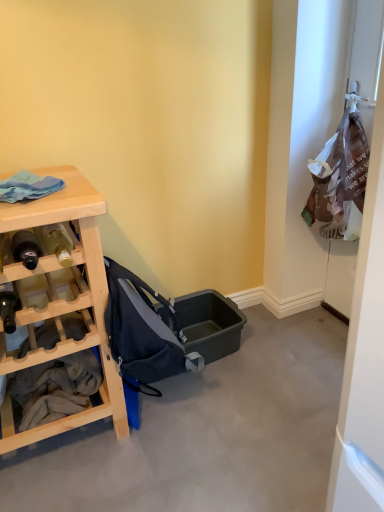
You are a GUI agent. You are given a task and a screenshot of the screen. Output one action in this format:
    pyautogui.click(x=<x>, y=<y>)
    Task: Click on the white cotton towels at left
    The image size is (384, 512).
    Given the screenshot: What is the action you would take?
    pyautogui.click(x=56, y=388)

What is the approximate width of matte black bottle at left, the third bottle in the top-to-bottom sequence?

matte black bottle at left, the third bottle in the top-to-bottom sequence, is 22.05 centimeters in width.

Looking at this image, measure the distance between point (79,220) and camera.

The distance of point (79,220) from camera is 1.14 meters.

Based on the photo, in order to face dark blue fabric baby carriage at center, should I rotate leftwards or rightwards?

Rotate left and turn 6.428 degrees.

Where is `white cotton towels at left`? white cotton towels at left is located at coordinates (56, 388).

Is natural wood desk at left aimed at matte black bottle at left, the third bottle in the top-to-bottom sequence?

Yes, natural wood desk at left is turned towards matte black bottle at left, the third bottle in the top-to-bottom sequence.

Can you confirm if natural wood desk at left is taller than matte black bottle at left, the 1th bottle ordered from the bottom?

Indeed, natural wood desk at left has a greater height compared to matte black bottle at left, the 1th bottle ordered from the bottom.

Considering the relative positions of natural wood desk at left and matte black bottle at left, the third bottle in the top-to-bottom sequence, in the image provided, is natural wood desk at left to the right of matte black bottle at left, the third bottle in the top-to-bottom sequence, from the viewer's perspective?

Yes, natural wood desk at left is to the right of matte black bottle at left, the third bottle in the top-to-bottom sequence.

From a real-world perspective, relative to matte black bottle at left, the 1th bottle ordered from the bottom, is natural wood desk at left vertically above or below?

In terms of real-world spatial position, natural wood desk at left is below matte black bottle at left, the 1th bottle ordered from the bottom.

Considering the relative positions of white cotton towels at left and matte black bottle at left, which is the second bottle in bottom-to-top order, in the image provided, is white cotton towels at left to the left or to the right of matte black bottle at left, which is the second bottle in bottom-to-top order,?

Based on their positions, white cotton towels at left is located to the left of matte black bottle at left, which is the second bottle in bottom-to-top order.

Considering the relative sizes of white cotton towels at left and matte black bottle at left, which is the second bottle in bottom-to-top order, in the image provided, is white cotton towels at left shorter than matte black bottle at left, which is the second bottle in bottom-to-top order,?

No, white cotton towels at left is not shorter than matte black bottle at left, which is the second bottle in bottom-to-top order.

Is white cotton towels at left positioned behind matte black bottle at left, which is the second bottle in bottom-to-top order?

Yes, the depth of white cotton towels at left is greater than that of matte black bottle at left, which is the second bottle in bottom-to-top order.

Would you say white cotton towels at left contains matte black bottle at left, which is the second bottle in bottom-to-top order?

Actually, matte black bottle at left, which is the second bottle in bottom-to-top order, is outside white cotton towels at left.

Does matte black bottle at left, which ranks as the 2th bottle in top-to-bottom order, have a greater width compared to white paper bag at right?

Yes, matte black bottle at left, which ranks as the 2th bottle in top-to-bottom order, is wider than white paper bag at right.

Does matte black bottle at left, which ranks as the 2th bottle in top-to-bottom order, touch white paper bag at right?

No, matte black bottle at left, which ranks as the 2th bottle in top-to-bottom order, is not with white paper bag at right.

Considering the positions of point (32, 236) and point (370, 208), is point (32, 236) closer or farther from the camera than point (370, 208)?

Clearly, point (32, 236) is more distant from the camera than point (370, 208).

How distant is dark blue fabric baby carriage at center from matte glass bottle at left, marked as the third bottle in a bottom-to-top arrangement?

The distance of dark blue fabric baby carriage at center from matte glass bottle at left, marked as the third bottle in a bottom-to-top arrangement, is 13.03 inches.

Is dark blue fabric baby carriage at center placed right next to matte glass bottle at left, marked as the third bottle in a bottom-to-top arrangement?

dark blue fabric baby carriage at center is not next to matte glass bottle at left, marked as the third bottle in a bottom-to-top arrangement, and they're not touching.

Considering the sizes of objects dark blue fabric baby carriage at center and matte glass bottle at left, marked as the third bottle in a bottom-to-top arrangement, in the image provided, who is bigger, dark blue fabric baby carriage at center or matte glass bottle at left, marked as the third bottle in a bottom-to-top arrangement,?

dark blue fabric baby carriage at center.

Which is more to the left, dark blue fabric baby carriage at center or matte glass bottle at left, marked as the third bottle in a bottom-to-top arrangement?

Positioned to the left is matte glass bottle at left, marked as the third bottle in a bottom-to-top arrangement.

Is natural wood desk at left surrounded by matte black bottle at left, the 1th bottle ordered from the bottom?

Definitely not — natural wood desk at left is not inside matte black bottle at left, the 1th bottle ordered from the bottom.

Could you tell me if matte black bottle at left, the 1th bottle ordered from the bottom, is facing natural wood desk at left?

Yes.

Are matte black bottle at left, the 1th bottle ordered from the bottom, and natural wood desk at left beside each other?

matte black bottle at left, the 1th bottle ordered from the bottom, and natural wood desk at left are not in contact.

Considering the positions of objects matte black bottle at left, the third bottle in the top-to-bottom sequence, and natural wood desk at left in the image provided, who is more to the left, matte black bottle at left, the third bottle in the top-to-bottom sequence, or natural wood desk at left?

From the viewer's perspective, matte black bottle at left, the third bottle in the top-to-bottom sequence, appears more on the left side.

From a real-world perspective, is matte glass bottle at left, which ranks as the first bottle in top-to-bottom order, physically located above or below matte black bottle at left, the 1th bottle ordered from the bottom?

Clearly, from a real-world perspective, matte glass bottle at left, which ranks as the first bottle in top-to-bottom order, is above matte black bottle at left, the 1th bottle ordered from the bottom.

Between matte glass bottle at left, which ranks as the first bottle in top-to-bottom order, and matte black bottle at left, the 1th bottle ordered from the bottom, which one is positioned in front?

matte black bottle at left, the 1th bottle ordered from the bottom, is in front.

Considering the relative sizes of matte glass bottle at left, marked as the third bottle in a bottom-to-top arrangement, and matte black bottle at left, the 1th bottle ordered from the bottom, in the image provided, is matte glass bottle at left, marked as the third bottle in a bottom-to-top arrangement, shorter than matte black bottle at left, the 1th bottle ordered from the bottom,?

Indeed, matte glass bottle at left, marked as the third bottle in a bottom-to-top arrangement, has a lesser height compared to matte black bottle at left, the 1th bottle ordered from the bottom.

Is dark blue fabric baby carriage at center positioned before natural wood desk at left?

No, dark blue fabric baby carriage at center is further to the viewer.

Which of these two, dark blue fabric baby carriage at center or natural wood desk at left, is bigger?

natural wood desk at left is bigger.

Who is taller, dark blue fabric baby carriage at center or natural wood desk at left?

Standing taller between the two is natural wood desk at left.

Where is `bottle located on the left of natural wood desk at left`? This screenshot has width=384, height=512. bottle located on the left of natural wood desk at left is located at coordinates (9, 310).

From the white cotton towels at left, count 1st bottle to the right and point to it. Please provide its 2D coordinates.

[(26, 248)]

From the image, which object appears to be farther from white paper bag at right, matte black bottle at left, which is the second bottle in bottom-to-top order, or natural wood desk at left?

Based on the image, matte black bottle at left, which is the second bottle in bottom-to-top order, appears to be further to white paper bag at right.

When comparing their distances from matte black bottle at left, which is the second bottle in bottom-to-top order, does dark blue fabric baby carriage at center or matte black bottle at left, the third bottle in the top-to-bottom sequence, seem closer?

Among the two, matte black bottle at left, the third bottle in the top-to-bottom sequence, is located nearer to matte black bottle at left, which is the second bottle in bottom-to-top order.

When comparing their distances from white cotton towels at left, does matte black bottle at left, the third bottle in the top-to-bottom sequence, or matte black bottle at left, which is the second bottle in bottom-to-top order, seem closer?

matte black bottle at left, the third bottle in the top-to-bottom sequence.

Considering their positions, is white cotton towels at left positioned closer to matte black bottle at left, which is the second bottle in bottom-to-top order, than matte black bottle at left, the 1th bottle ordered from the bottom?

Among the two, matte black bottle at left, the 1th bottle ordered from the bottom, is located nearer to matte black bottle at left, which is the second bottle in bottom-to-top order.

Estimate the real-world distances between objects in this image. Which object is closer to matte black bottle at left, the third bottle in the top-to-bottom sequence, matte black bottle at left, which ranks as the 2th bottle in top-to-bottom order, or white paper bag at right?

matte black bottle at left, which ranks as the 2th bottle in top-to-bottom order, is positioned closer to the anchor matte black bottle at left, the third bottle in the top-to-bottom sequence.

Which object lies nearer to the anchor point dark blue fabric baby carriage at center, white cotton towels at left or matte glass bottle at left, which ranks as the first bottle in top-to-bottom order?

The object closer to dark blue fabric baby carriage at center is white cotton towels at left.

When comparing their distances from matte black bottle at left, the third bottle in the top-to-bottom sequence, does matte black bottle at left, which is the second bottle in bottom-to-top order, or natural wood desk at left seem closer?

The object closer to matte black bottle at left, the third bottle in the top-to-bottom sequence, is matte black bottle at left, which is the second bottle in bottom-to-top order.

Considering their positions, is natural wood desk at left positioned further to matte black bottle at left, the third bottle in the top-to-bottom sequence, than matte glass bottle at left, marked as the third bottle in a bottom-to-top arrangement?

The object further to matte black bottle at left, the third bottle in the top-to-bottom sequence, is natural wood desk at left.

Identify the location of desk between matte glass bottle at left, marked as the third bottle in a bottom-to-top arrangement, and white cotton towels at left in the up-down direction. (62, 302).

At what (x,y) coordinates should I click in order to perform the action: click on desk between matte black bottle at left, the third bottle in the top-to-bottom sequence, and white paper bag at right. Please return your answer as a coordinate pair (x, y). Image resolution: width=384 pixels, height=512 pixels. Looking at the image, I should click on (62, 302).

This screenshot has width=384, height=512. I want to click on bottle between matte black bottle at left, which ranks as the 2th bottle in top-to-bottom order, and natural wood desk at left from top to bottom, so click(9, 310).

You are a GUI agent. You are given a task and a screenshot of the screen. Output one action in this format:
    pyautogui.click(x=<x>, y=<y>)
    Task: Click on the clothing located between matte black bottle at left, the third bottle in the top-to-bottom sequence, and white paper bag at right in the left-right direction
    
    Given the screenshot: What is the action you would take?
    pyautogui.click(x=56, y=388)